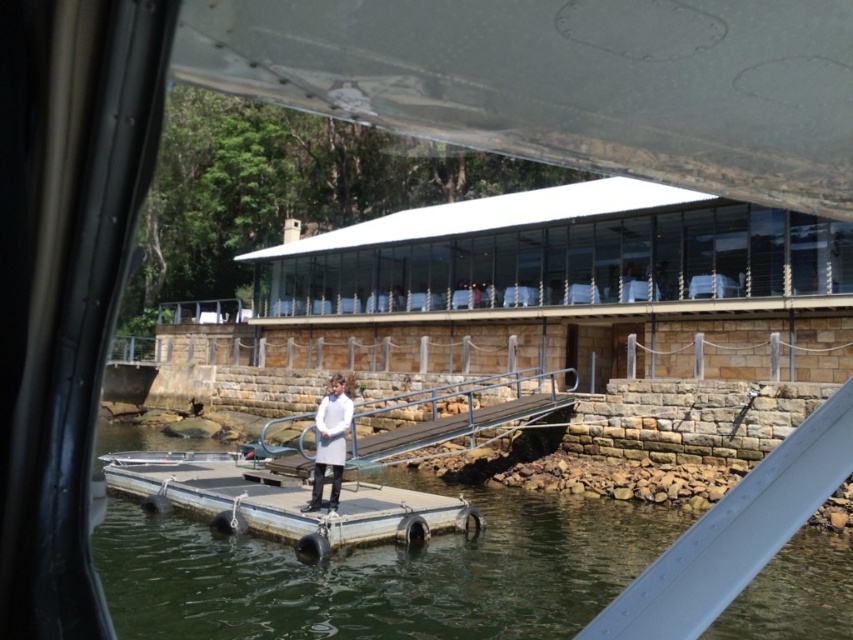
Question: Is the position of clear water at center more distant than that of metallic gray rail at center?

Choices:
 (A) yes
 (B) no

Answer: (B)

Question: Estimate the real-world distances between objects in this image. Which object is farther from the clear water at center?

Choices:
 (A) metallic gray rail at center
 (B) white matte coat at center

Answer: (B)

Question: Does clear water at center come in front of metallic gray rail at center?

Choices:
 (A) no
 (B) yes

Answer: (B)

Question: Which point is farther to the camera?

Choices:
 (A) (418, 396)
 (B) (630, 536)
 (C) (318, 406)

Answer: (C)

Question: Which point is farther from the camera taking this photo?

Choices:
 (A) (334, 392)
 (B) (195, 636)
 (C) (363, 408)

Answer: (C)

Question: Does clear water at center have a greater width compared to metallic gray rail at center?

Choices:
 (A) yes
 (B) no

Answer: (A)